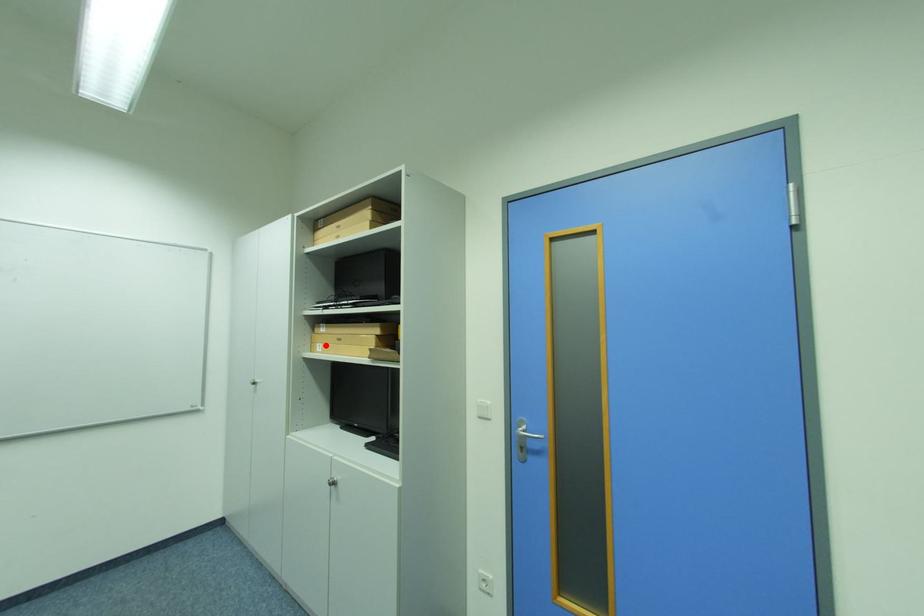
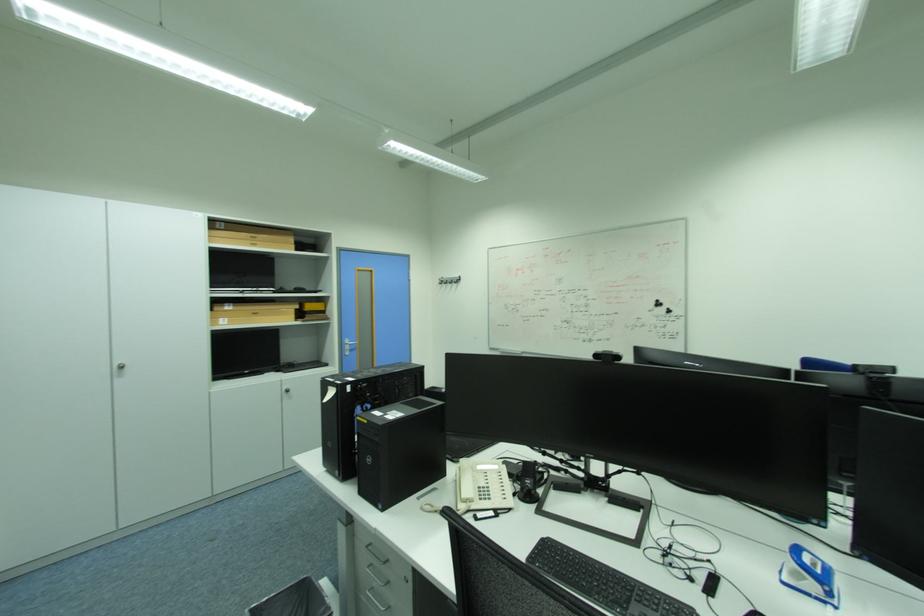
Locate, in the second image, the point that corresponds to the highlighted location in the first image.

(228, 320)